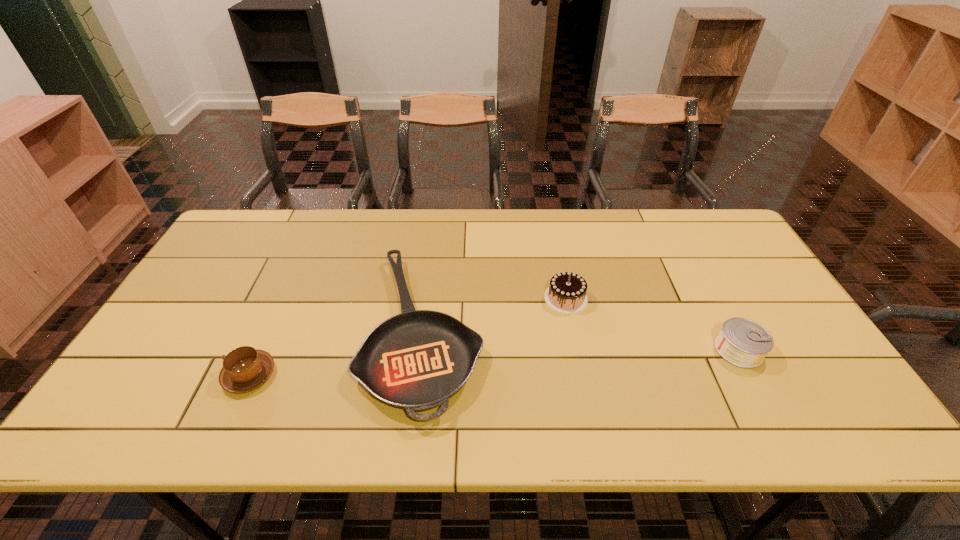
Locate an element on the screen. The height and width of the screenshot is (540, 960). free space in the image that satisfies the following two spatial constraints: 1. on the front side of the shortest object; 2. on the side of the cappuccino with the handle is located at coordinates (419, 375).

This screenshot has width=960, height=540. I want to click on vacant space that satisfies the following two spatial constraints: 1. on the front side of the shortest object; 2. on the right side of the can, so click(421, 350).